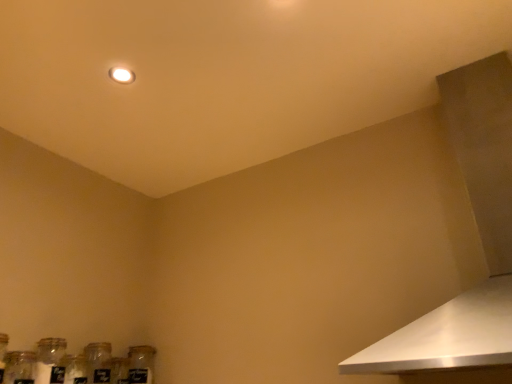
The width and height of the screenshot is (512, 384). What are the coordinates of `clear glass jar at lower left, which is counted as the 1th bottle, starting from the right` in the screenshot? It's located at (98, 362).

Considering the relative positions of white metallic vent at upper right and clear glass jar at lower left, which ranks as the 1th bottle in left-to-right order, in the image provided, is white metallic vent at upper right to the left of clear glass jar at lower left, which ranks as the 1th bottle in left-to-right order, from the viewer's perspective?

Incorrect, white metallic vent at upper right is not on the left side of clear glass jar at lower left, which ranks as the 1th bottle in left-to-right order.

Is white metallic vent at upper right wider than clear glass jar at lower left, which ranks as the 1th bottle in left-to-right order?

Correct, the width of white metallic vent at upper right exceeds that of clear glass jar at lower left, which ranks as the 1th bottle in left-to-right order.

Which object is further away from the camera, white metallic vent at upper right or clear glass jar at lower left, which ranks as the 1th bottle in left-to-right order?

clear glass jar at lower left, which ranks as the 1th bottle in left-to-right order, is behind.

Find the location of a particular element. vent in front of the clear glass jar at lower left, which ranks as the 1th bottle in left-to-right order is located at coordinates (479, 234).

Are white metallic vent at upper right and clear glass jar at lower left far apart?

Indeed, white metallic vent at upper right is not near clear glass jar at lower left.

Does point (490, 106) appear closer or farther from the camera than point (137, 364)?

Point (490, 106) is closer to the camera than point (137, 364).

Is white metallic vent at upper right smaller than clear glass jar at lower left?

No.

How many degrees apart are the facing directions of clear glass jar at lower left and clear glass jar at lower left, which ranks as the 1th bottle in left-to-right order?

They differ by 0.0016 degrees in their facing directions.

Is clear glass jar at lower left wider than clear glass jar at lower left, which ranks as the 1th bottle in left-to-right order?

No, clear glass jar at lower left is not wider than clear glass jar at lower left, which ranks as the 1th bottle in left-to-right order.

Is clear glass jar at lower left outside of clear glass jar at lower left, which is the second bottle from right to left?

Yes, clear glass jar at lower left is not within clear glass jar at lower left, which is the second bottle from right to left.

Does clear glass jar at lower left lie in front of clear glass jar at lower left, which is the second bottle from right to left?

Yes.

Is clear glass jar at lower left, which is the second bottle from right to left, facing towards clear glass jar at lower left?

No, clear glass jar at lower left, which is the second bottle from right to left, is not aimed at clear glass jar at lower left.

In terms of width, does clear glass jar at lower left, which is the second bottle from right to left, look wider or thinner when compared to clear glass jar at lower left?

In the image, clear glass jar at lower left, which is the second bottle from right to left, appears to be wider than clear glass jar at lower left.

From a real-world perspective, between clear glass jar at lower left, which is the second bottle from right to left, and clear glass jar at lower left, who is vertically higher?

clear glass jar at lower left, which is the second bottle from right to left, is physically above.

From the image's perspective, between clear glass jar at lower left and clear glass jar at lower left, who is located below?

clear glass jar at lower left is shown below in the image.

Is clear glass jar at lower left spatially inside clear glass jar at lower left, or outside of it?

clear glass jar at lower left is outside clear glass jar at lower left.

Is point (21, 376) closer to viewer compared to point (138, 380)?

Yes.

Between clear glass jar at lower left and clear glass jar at lower left, which is counted as the 1th bottle, starting from the right, which one has smaller size?

Smaller between the two is clear glass jar at lower left, which is counted as the 1th bottle, starting from the right.

Based on the photo, is clear glass jar at lower left to the left or to the right of clear glass jar at lower left, the second bottle from the left, in the image?

Clearly, clear glass jar at lower left is on the right of clear glass jar at lower left, the second bottle from the left, in the image.

Does clear glass jar at lower left come in front of clear glass jar at lower left, the second bottle from the left?

No.

Consider the image. Looking at their sizes, would you say clear glass jar at lower left is wider or thinner than clear glass jar at lower left, which ranks as the 1th bottle in left-to-right order?

Clearly, clear glass jar at lower left has less width compared to clear glass jar at lower left, which ranks as the 1th bottle in left-to-right order.

Is there a large distance between clear glass jar at lower left and clear glass jar at lower left, which is the second bottle from right to left?

Actually, clear glass jar at lower left and clear glass jar at lower left, which is the second bottle from right to left, are a little close together.

Is clear glass jar at lower left oriented towards clear glass jar at lower left, which is the second bottle from right to left?

No, clear glass jar at lower left does not turn towards clear glass jar at lower left, which is the second bottle from right to left.

You are a GUI agent. You are given a task and a screenshot of the screen. Output one action in this format:
    pyautogui.click(x=<x>, y=<y>)
    Task: Click on the vent located on the right of clear glass jar at lower left, which is the second bottle from right to left
    
    Given the screenshot: What is the action you would take?
    pyautogui.click(x=479, y=234)

Find the location of `vent located in front of the clear glass jar at lower left`. vent located in front of the clear glass jar at lower left is located at coordinates (479, 234).

From the image, which object appears to be nearer to clear glass jar at lower left, which is counted as the 1th bottle, starting from the right, clear glass jar at lower left or clear glass jar at lower left, which is the second bottle from right to left?

clear glass jar at lower left, which is the second bottle from right to left, is positioned closer to the anchor clear glass jar at lower left, which is counted as the 1th bottle, starting from the right.

Based on their spatial positions, is clear glass jar at lower left or clear glass jar at lower left closer to white metallic vent at upper right?

clear glass jar at lower left lies closer to white metallic vent at upper right than the other object.

Looking at the image, which one is located further to clear glass jar at lower left, which is the second bottle from right to left, clear glass jar at lower left or clear glass jar at lower left, which is counted as the 1th bottle, starting from the right?

The object further to clear glass jar at lower left, which is the second bottle from right to left, is clear glass jar at lower left, which is counted as the 1th bottle, starting from the right.

When comparing their distances from white metallic vent at upper right, does clear glass jar at lower left, which is the second bottle from right to left, or clear glass jar at lower left seem further?

clear glass jar at lower left, which is the second bottle from right to left, is further to white metallic vent at upper right.

When comparing their distances from clear glass jar at lower left, which is counted as the 1th bottle, starting from the right, does clear glass jar at lower left or white metallic vent at upper right seem further?

Among the two, white metallic vent at upper right is located further to clear glass jar at lower left, which is counted as the 1th bottle, starting from the right.

Estimate the real-world distances between objects in this image. Which object is closer to clear glass jar at lower left, clear glass jar at lower left or white metallic vent at upper right?

Based on the image, clear glass jar at lower left appears to be nearer to clear glass jar at lower left.

Considering their positions, is clear glass jar at lower left, the second bottle from the left, positioned closer to clear glass jar at lower left than clear glass jar at lower left?

The object closer to clear glass jar at lower left is clear glass jar at lower left, the second bottle from the left.

Looking at the image, which one is located closer to white metallic vent at upper right, clear glass jar at lower left or clear glass jar at lower left, which ranks as the 1th bottle in left-to-right order?

Based on the image, clear glass jar at lower left, which ranks as the 1th bottle in left-to-right order, appears to be nearer to white metallic vent at upper right.

Where is `bottle between clear glass jar at lower left and clear glass jar at lower left, which is counted as the 1th bottle, starting from the right, in the front-back direction`? This screenshot has height=384, width=512. bottle between clear glass jar at lower left and clear glass jar at lower left, which is counted as the 1th bottle, starting from the right, in the front-back direction is located at coordinates (50, 361).

Where is `bottle situated between clear glass jar at lower left, which is the second bottle from right to left, and white metallic vent at upper right from left to right`? bottle situated between clear glass jar at lower left, which is the second bottle from right to left, and white metallic vent at upper right from left to right is located at coordinates (98, 362).

At what (x,y) coordinates should I click in order to perform the action: click on glass bottle between clear glass jar at lower left and white metallic vent at upper right. Please return your answer as a coordinate pair (x, y). Looking at the image, I should click on (141, 364).

Where is `bottle between clear glass jar at lower left, which ranks as the 1th bottle in left-to-right order, and clear glass jar at lower left, along the z-axis`? The width and height of the screenshot is (512, 384). bottle between clear glass jar at lower left, which ranks as the 1th bottle in left-to-right order, and clear glass jar at lower left, along the z-axis is located at coordinates (98, 362).